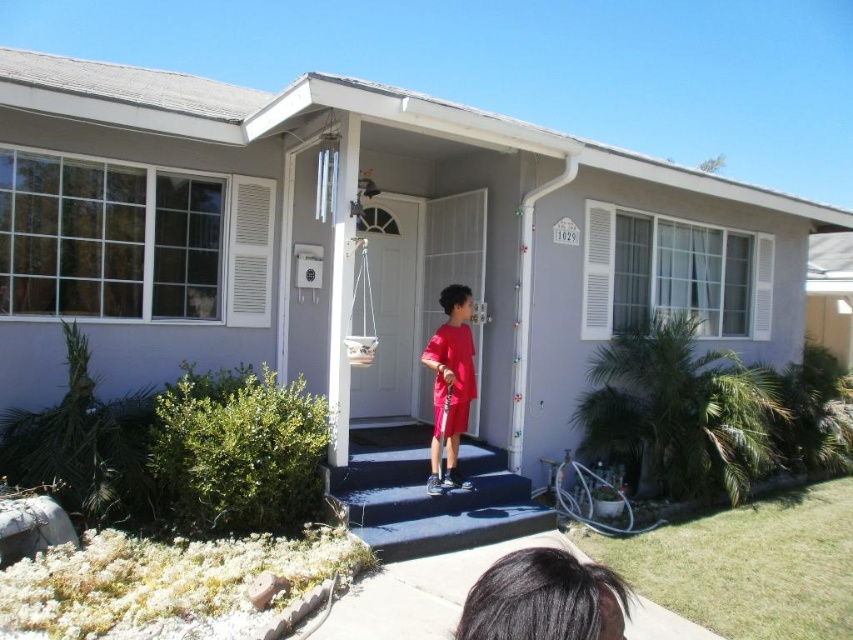
You are a delivery person trying to reach the door of the suburban house. You see the smooth concrete steps at center and the matte red shorts at center. Which object is closer to the ground?

The smooth concrete steps at center are closer to the ground since they have a lesser height compared to the matte red shorts at center.

You are a delivery person trying to reach the front door of the house. You see the smooth concrete steps at center and the matte red shorts at center. Which object is closer to you as you approach the house?

The smooth concrete steps at center is 19.93 inches from matte red shorts at center, so the smooth concrete steps at center is closer to you as you approach the house.